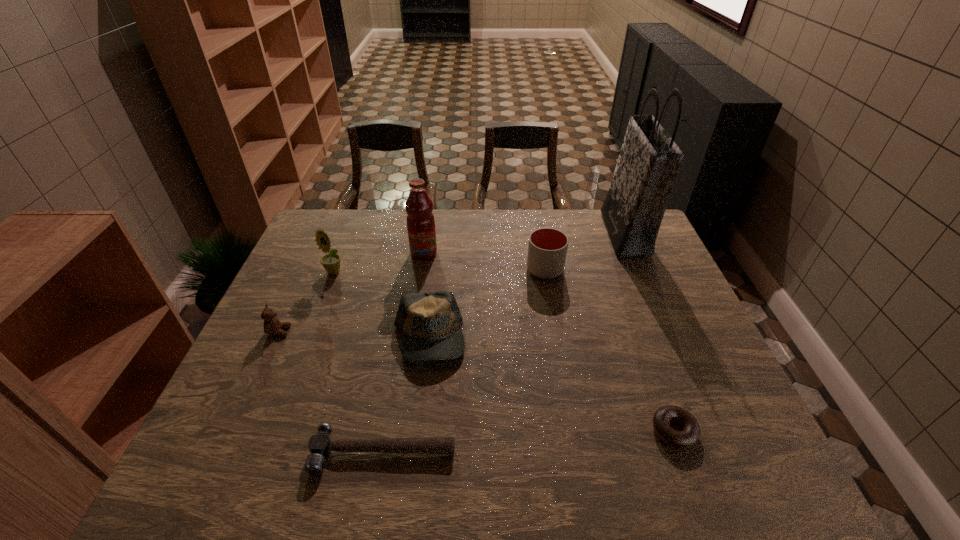
The height and width of the screenshot is (540, 960). What are the coordinates of `fruit juice located in the far edge section of the desktop` in the screenshot? It's located at (420, 220).

Identify the location of doughnut located at the near edge. (691, 433).

You are a GUI agent. You are given a task and a screenshot of the screen. Output one action in this format:
    pyautogui.click(x=<x>, y=<y>)
    Task: Click on the hammer that is at the near edge
    The height and width of the screenshot is (540, 960).
    Given the screenshot: What is the action you would take?
    pyautogui.click(x=320, y=445)

Identify the location of sunflower at the left edge. The height and width of the screenshot is (540, 960). (331, 262).

Where is `teddy bear located in the left edge section of the desktop`? The height and width of the screenshot is (540, 960). teddy bear located in the left edge section of the desktop is located at coordinates (272, 325).

Locate an element on the screen. This screenshot has width=960, height=540. shopping bag that is at the right edge is located at coordinates (649, 161).

Image resolution: width=960 pixels, height=540 pixels. Identify the location of doughnut that is positioned at the right edge. (691, 433).

The image size is (960, 540). In order to click on object that is at the far right corner in this screenshot , I will do `click(649, 161)`.

Identify the location of object at the near right corner. (691, 433).

Where is `free region at the far edge of the desktop`? free region at the far edge of the desktop is located at coordinates (533, 220).